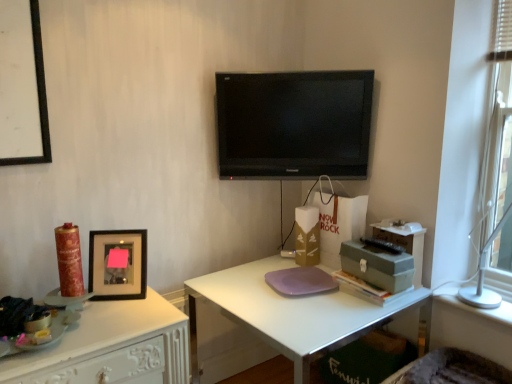
The image size is (512, 384). In order to click on empty space that is to the right of shiny gold candle at left in this screenshot , I will do `click(115, 309)`.